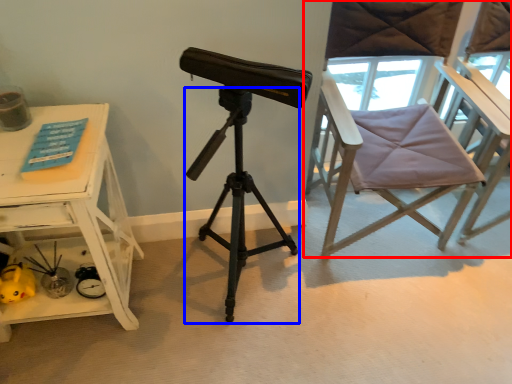
Question: Which object is further to the camera taking this photo, chair (highlighted by a red box) or tripod (highlighted by a blue box)?

Choices:
 (A) chair
 (B) tripod

Answer: (A)